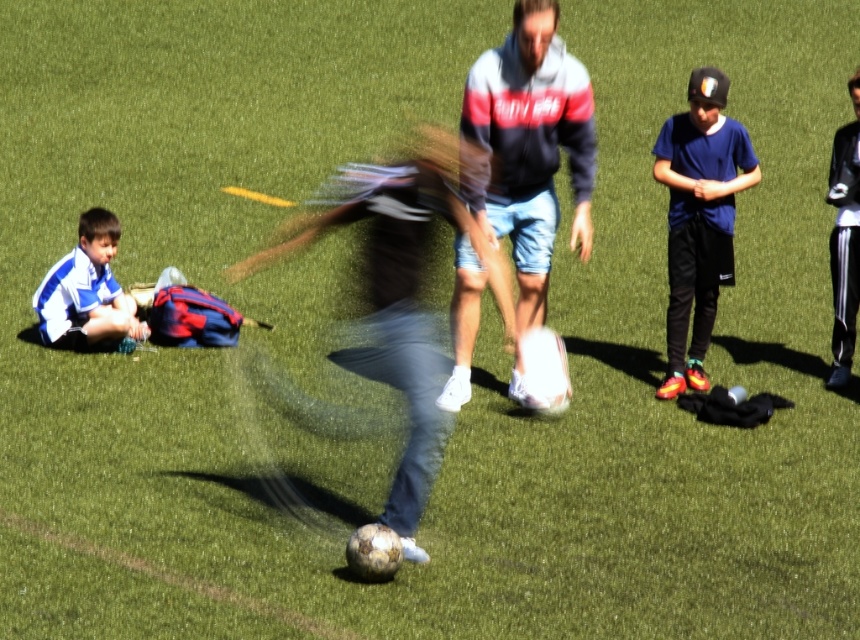
You are a photographer trying to capture a group photo of the striped jersey at lower left and the black leather jacket at right. Based on their positions, which one should you place on the left side of the photo to maintain their original spatial arrangement?

The striped jersey at lower left should be placed on the left side of the photo to maintain their original spatial arrangement since it is positioned on the left side of the black leather jacket at right.

You are standing on the soccer field and want to throw a ball to the point marked at coordinates point (538, 230). If your throwing range is 10 meters, will you be able to reach that point?

The point (538, 230) is 9.75 meters from the viewer, so yes, you can reach it with your throwing range of 10 meters.